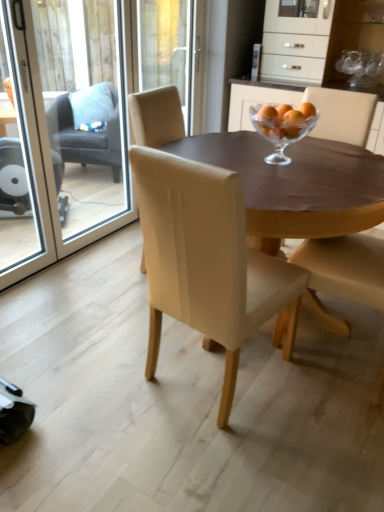
Question: From a real-world perspective, is beige leather chair at center, which is the 3th chair in left-to-right order, below matte beige chair at center, the 3th chair when ordered from back to front?

Choices:
 (A) no
 (B) yes

Answer: (B)

Question: Is matte beige chair at center, the 3th chair when ordered from back to front, at the back of beige leather chair at center, the 1th chair viewed from the front?

Choices:
 (A) yes
 (B) no

Answer: (B)

Question: Can you confirm if beige leather chair at center, which is the fourth chair in back-to-front order, is bigger than matte beige chair at center, which is the 2th chair from front to back?

Choices:
 (A) yes
 (B) no

Answer: (A)

Question: Is the surface of beige leather chair at center, which is the fourth chair in back-to-front order, in direct contact with matte beige chair at center, the 3th chair when ordered from back to front?

Choices:
 (A) yes
 (B) no

Answer: (B)

Question: From the image's perspective, does beige leather chair at center, positioned as the 2th chair in right-to-left order, appear lower than matte beige chair at center, positioned as the 4th chair in left-to-right order?

Choices:
 (A) yes
 (B) no

Answer: (A)

Question: Does point (349, 281) appear closer or farther from the camera than point (187, 226)?

Choices:
 (A) farther
 (B) closer

Answer: (A)

Question: Is matte beige chair at center, the 3th chair when ordered from back to front, bigger or smaller than beige leather chair at center, positioned as the 2th chair in right-to-left order?

Choices:
 (A) big
 (B) small

Answer: (B)

Question: Is matte beige chair at center, which ranks as the 1th chair in right-to-left order, inside the boundaries of beige leather chair at center, which is the 3th chair in left-to-right order, or outside?

Choices:
 (A) inside
 (B) outside

Answer: (B)

Question: Is matte beige chair at center, positioned as the 4th chair in left-to-right order, wider or thinner than beige leather chair at center, which is the 3th chair in left-to-right order?

Choices:
 (A) wide
 (B) thin

Answer: (B)

Question: Would you say transparent glass screen door at left, the second screen door positioned from the right, is to the left or to the right of light gray fabric chair at left, marked as the first chair in a back-to-front arrangement, in the picture?

Choices:
 (A) left
 (B) right

Answer: (B)

Question: Is transparent glass screen door at left, positioned as the 1th screen door in left-to-right order, inside the boundaries of light gray fabric chair at left, the 4th chair positioned from the front, or outside?

Choices:
 (A) inside
 (B) outside

Answer: (B)

Question: From the image's perspective, relative to light gray fabric chair at left, acting as the fourth chair starting from the right, is transparent glass screen door at left, positioned as the 1th screen door in left-to-right order, above or below?

Choices:
 (A) below
 (B) above

Answer: (A)

Question: In terms of height, does transparent glass screen door at left, positioned as the 1th screen door in left-to-right order, look taller or shorter compared to light gray fabric chair at left, acting as the fourth chair starting from the right?

Choices:
 (A) short
 (B) tall

Answer: (B)

Question: Looking at the image, does transparent glass screen door at left, which appears as the first screen door when viewed from the right, seem bigger or smaller compared to matte beige chair at center, the 3th chair when ordered from back to front?

Choices:
 (A) small
 (B) big

Answer: (A)

Question: Is transparent glass screen door at left, which is counted as the second screen door, starting from the left, situated inside matte beige chair at center, which ranks as the 1th chair in right-to-left order, or outside?

Choices:
 (A) inside
 (B) outside

Answer: (B)